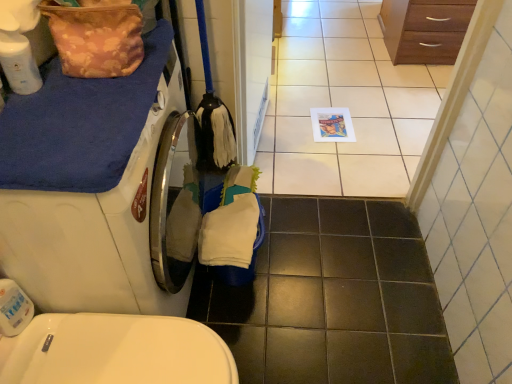
Question: Can you confirm if floral fabric bag at upper left is positioned to the left of wooden chest of drawers at upper right?

Choices:
 (A) yes
 (B) no

Answer: (A)

Question: From a real-world perspective, is floral fabric bag at upper left below wooden chest of drawers at upper right?

Choices:
 (A) yes
 (B) no

Answer: (B)

Question: Is floral fabric bag at upper left facing away from wooden chest of drawers at upper right?

Choices:
 (A) yes
 (B) no

Answer: (B)

Question: Is floral fabric bag at upper left positioned far away from wooden chest of drawers at upper right?

Choices:
 (A) yes
 (B) no

Answer: (A)

Question: From the image's perspective, would you say floral fabric bag at upper left is shown under wooden chest of drawers at upper right?

Choices:
 (A) no
 (B) yes

Answer: (B)

Question: Can you confirm if floral fabric bag at upper left is shorter than wooden chest of drawers at upper right?

Choices:
 (A) yes
 (B) no

Answer: (A)

Question: Can you confirm if white glossy screen door at center is positioned to the right of floral fabric bag at upper left?

Choices:
 (A) no
 (B) yes

Answer: (B)

Question: Is white glossy screen door at center facing towards floral fabric bag at upper left?

Choices:
 (A) yes
 (B) no

Answer: (B)

Question: Is white glossy screen door at center positioned with its back to floral fabric bag at upper left?

Choices:
 (A) no
 (B) yes

Answer: (A)

Question: Are white glossy screen door at center and floral fabric bag at upper left beside each other?

Choices:
 (A) yes
 (B) no

Answer: (B)

Question: From a real-world perspective, does white glossy screen door at center stand above floral fabric bag at upper left?

Choices:
 (A) no
 (B) yes

Answer: (A)

Question: Would you say white glossy screen door at center contains floral fabric bag at upper left?

Choices:
 (A) yes
 (B) no

Answer: (B)

Question: Would you say floral fabric bag at upper left is a long distance from white glossy screen door at center?

Choices:
 (A) yes
 (B) no

Answer: (B)